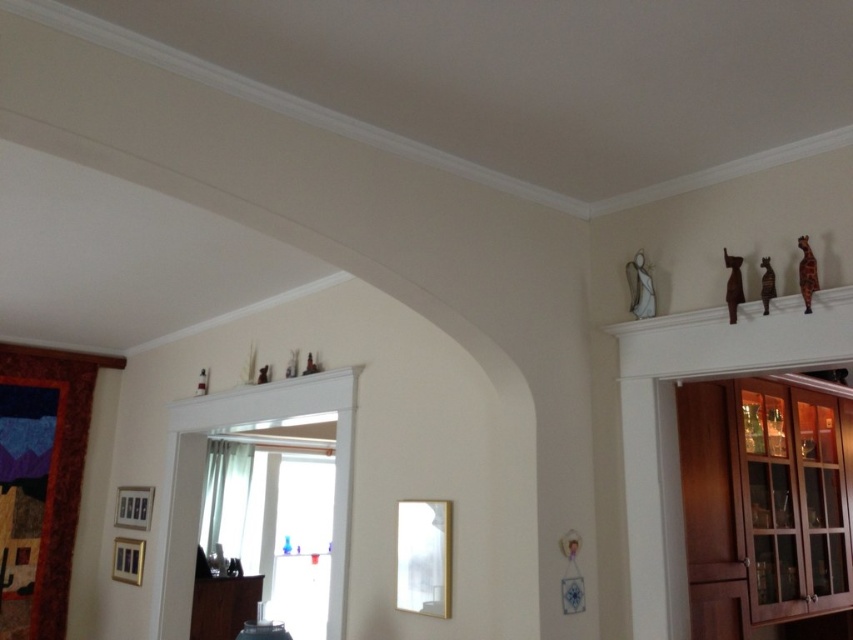
You are moving a sofa that is 3 meters long into the living room. You want to place it between the brown wooden cabinet at right and the wooden cabinet at lower left. Is there enough space to fit the sofa between them?

The distance between the brown wooden cabinet at right and the wooden cabinet at lower left is 3.50 meters, so yes, the sofa can fit since it is shorter than the available space.

You are planning to move a large painting that is 1.5 meters wide to the wall above the brown wooden cabinet at right and wooden cabinet at lower left. Which cabinet should the painting be placed above to ensure it fits properly?

The painting should be placed above the brown wooden cabinet at right because its width is larger than the wooden cabinet at lower left, ensuring the painting will fit better.